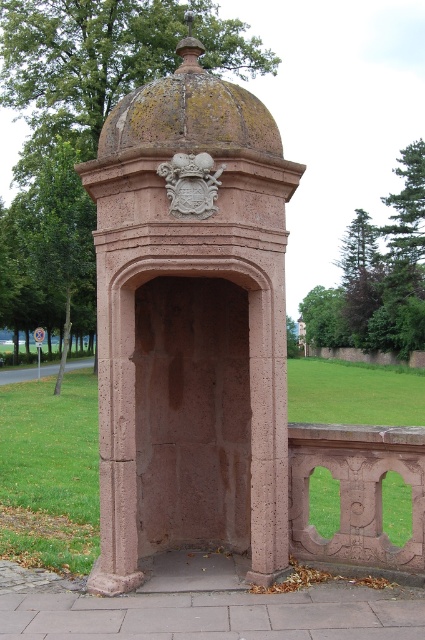
From the picture: Does rustic stone gazebo at center have a lesser height compared to rusty stone dome at upper center?

Indeed, rustic stone gazebo at center has a lesser height compared to rusty stone dome at upper center.

Image resolution: width=425 pixels, height=640 pixels. In order to click on rustic stone gazebo at center in this screenshot , I will do `click(190, 323)`.

Image resolution: width=425 pixels, height=640 pixels. In order to click on rustic stone gazebo at center in this screenshot , I will do `click(190, 323)`.